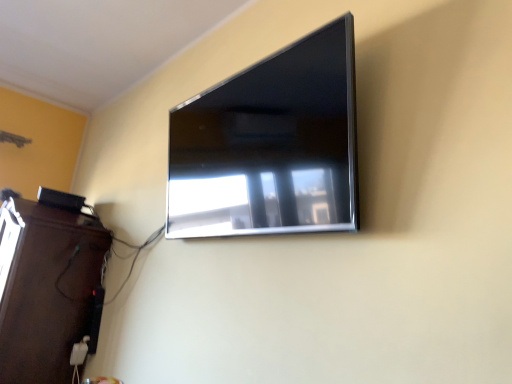
Question: From a real-world perspective, is dark wood entertainment center at lower left over satin black tv at upper center?

Choices:
 (A) no
 (B) yes

Answer: (A)

Question: Are dark wood entertainment center at lower left and satin black tv at upper center located far from each other?

Choices:
 (A) yes
 (B) no

Answer: (A)

Question: Considering the relative sizes of dark wood entertainment center at lower left and satin black tv at upper center in the image provided, is dark wood entertainment center at lower left smaller than satin black tv at upper center?

Choices:
 (A) yes
 (B) no

Answer: (B)

Question: From the image's perspective, would you say dark wood entertainment center at lower left is shown under satin black tv at upper center?

Choices:
 (A) yes
 (B) no

Answer: (A)

Question: Does dark wood entertainment center at lower left appear on the right side of satin black tv at upper center?

Choices:
 (A) yes
 (B) no

Answer: (B)

Question: Could you tell me if dark wood entertainment center at lower left is facing satin black tv at upper center?

Choices:
 (A) no
 (B) yes

Answer: (A)

Question: Is the surface of satin black tv at upper center in direct contact with dark wood entertainment center at lower left?

Choices:
 (A) yes
 (B) no

Answer: (B)

Question: Considering the relative sizes of satin black tv at upper center and dark wood entertainment center at lower left in the image provided, is satin black tv at upper center smaller than dark wood entertainment center at lower left?

Choices:
 (A) yes
 (B) no

Answer: (A)

Question: Considering the relative sizes of satin black tv at upper center and dark wood entertainment center at lower left in the image provided, is satin black tv at upper center taller than dark wood entertainment center at lower left?

Choices:
 (A) yes
 (B) no

Answer: (B)

Question: From a real-world perspective, does satin black tv at upper center stand above dark wood entertainment center at lower left?

Choices:
 (A) yes
 (B) no

Answer: (A)

Question: From the image's perspective, is satin black tv at upper center above dark wood entertainment center at lower left?

Choices:
 (A) no
 (B) yes

Answer: (B)

Question: From a real-world perspective, is satin black tv at upper center beneath dark wood entertainment center at lower left?

Choices:
 (A) no
 (B) yes

Answer: (A)

Question: Would you say dark wood entertainment center at lower left is inside or outside satin black tv at upper center?

Choices:
 (A) outside
 (B) inside

Answer: (A)